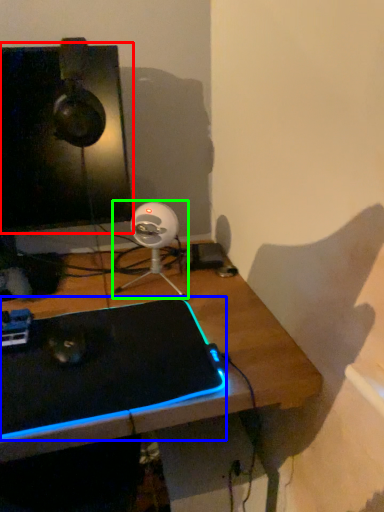
Question: Based on their relative distances, which object is nearer to computer monitor (highlighted by a red box)? Choose from laptop (highlighted by a blue box) and fan (highlighted by a green box).

Choices:
 (A) laptop
 (B) fan

Answer: (B)